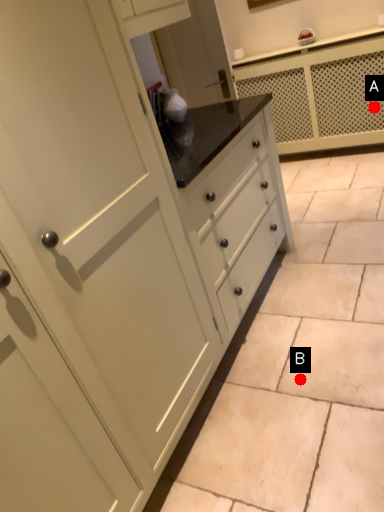
Question: Two points are circled on the image, labeled by A and B beside each circle. Which point is farther to the camera?

Choices:
 (A) A is further
 (B) B is further

Answer: (A)